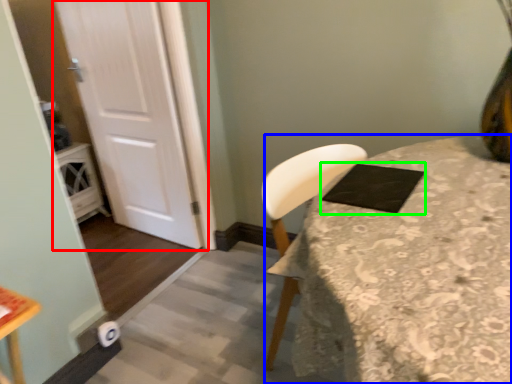
Question: Considering the real-world distances, which object is farthest from door (highlighted by a red box)? table (highlighted by a blue box) or pad (highlighted by a green box)?

Choices:
 (A) table
 (B) pad

Answer: (A)